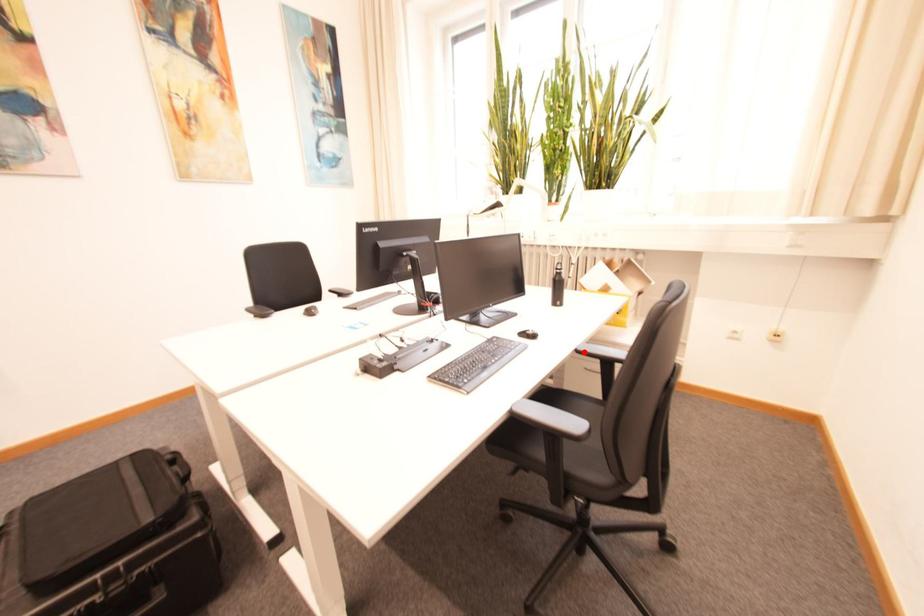
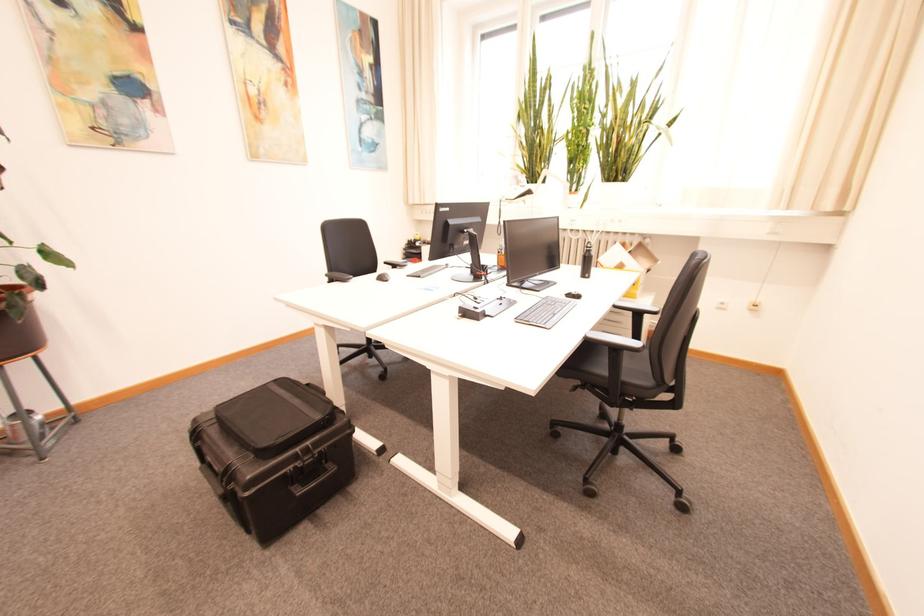
Find the pixel in the second image that matches the highlighted location in the first image.

(622, 308)